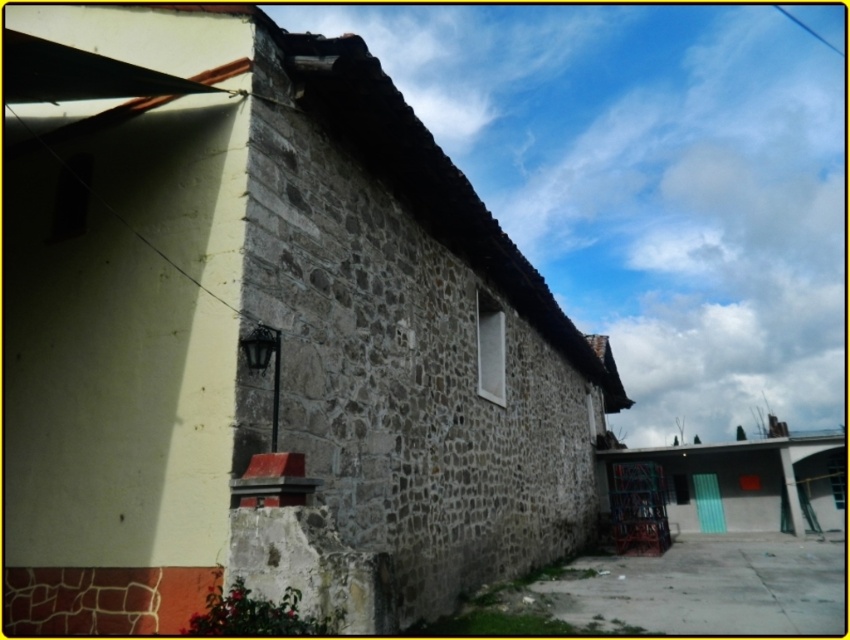
You are a painter hired to paint the building. You notice the stone wall at center and the green painted wood hut at lower right. Which structure should you prioritize painting first if you want to start with the taller one?

The green painted wood hut at lower right is taller than the stone wall at center, so you should prioritize painting the green painted wood hut at lower right first.

You are standing in front of the building and notice a point marked at coordinates (265, 339). What architectural feature is located at that point?

The stone wall at center is located at point (265, 339).

You are a delivery person with a cart that is 3 meters wide. You need to move from the stone wall at center to the green painted wood hut at lower right. Can your cart fit through the space between them?

The distance between the stone wall at center and the green painted wood hut at lower right is 8.52 meters. Since your cart is only 3 meters wide, it can easily fit through the space between them.